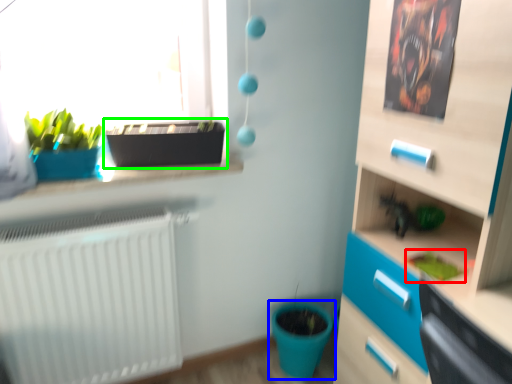
Question: Based on their relative distances, which object is nearer to plant (highlighted by a red box)? Choose from flowerpot (highlighted by a blue box) and flowerpot (highlighted by a green box).

Choices:
 (A) flowerpot
 (B) flowerpot

Answer: (A)